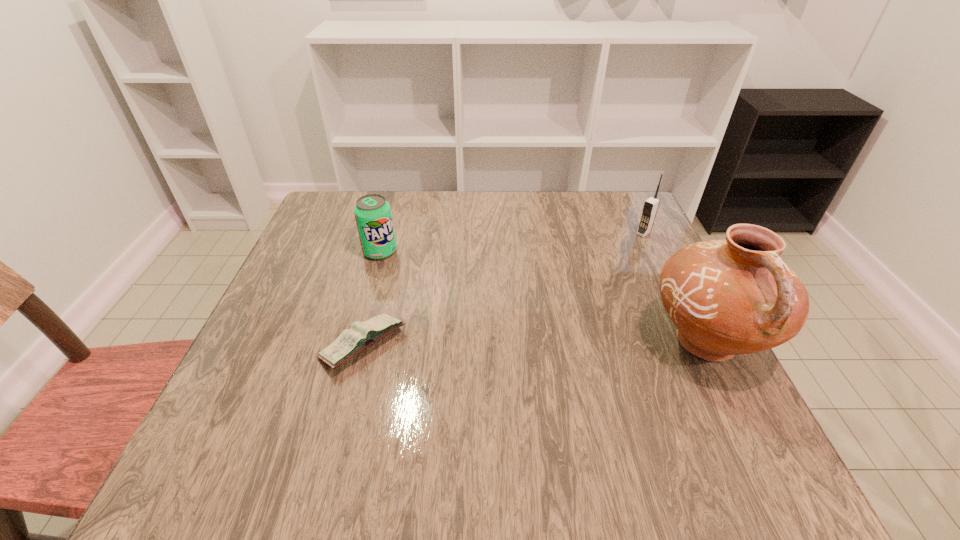
At what (x,y) coordinates should I click in order to perform the action: click on vacant space on the desktop that is between the shortest object and the pottery and is positioned on the front-facing side of the cellular telephone. Please return your answer as a coordinate pair (x, y). Looking at the image, I should click on coord(513,343).

Locate an element on the screen. The image size is (960, 540). vacant space on the desktop that is between the diary and the tallest object and is positioned on the front-facing side of the second farthest object is located at coordinates (498, 343).